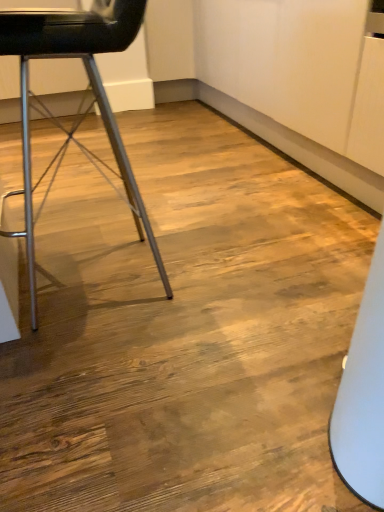
The image size is (384, 512). Identify the location of vacant space in matte black chair at left (from a real-world perspective). (110, 272).